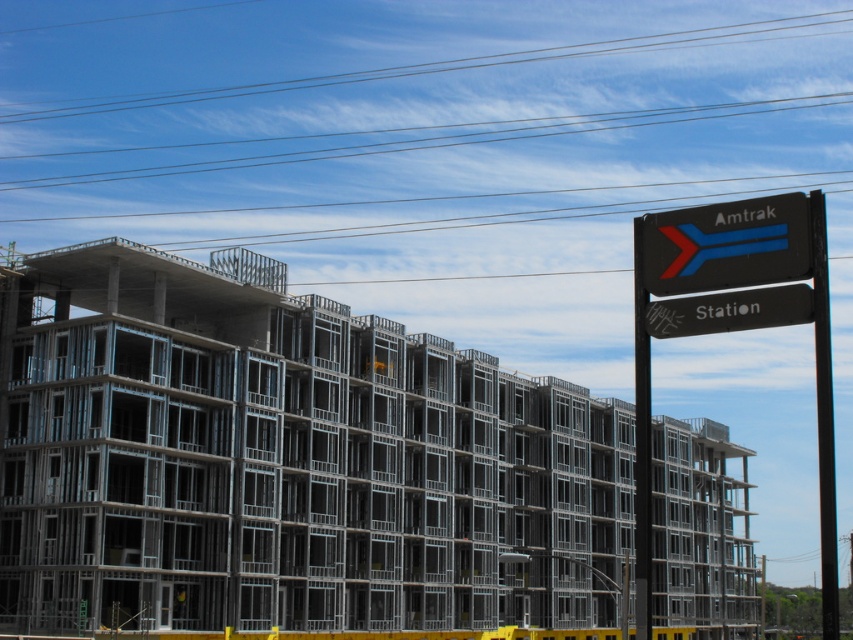
Can you confirm if black metal sign at upper right is positioned below black metal pole at right?

Actually, black metal sign at upper right is above black metal pole at right.

From the picture: Does black metal sign at upper right have a greater height compared to black metal pole at right?

In fact, black metal sign at upper right may be shorter than black metal pole at right.

Identify the location of black metal sign at upper right. This screenshot has height=640, width=853. (733, 330).

Who is shorter, gray concrete building at right or black metal pole at right?

gray concrete building at right

Is point (526, 396) positioned behind point (833, 572)?

That is True.

Locate an element on the screen. gray concrete building at right is located at coordinates (285, 461).

Between black metal sign at upper right and black plastic sign at upper right, which one is positioned higher?

black plastic sign at upper right is higher up.

Can you confirm if black metal sign at upper right is positioned to the left of black plastic sign at upper right?

No, black metal sign at upper right is not to the left of black plastic sign at upper right.

Which is behind, point (679, 259) or point (775, 228)?

The point (679, 259) is behind.

Identify the location of black metal sign at upper right. This screenshot has height=640, width=853. (733, 330).